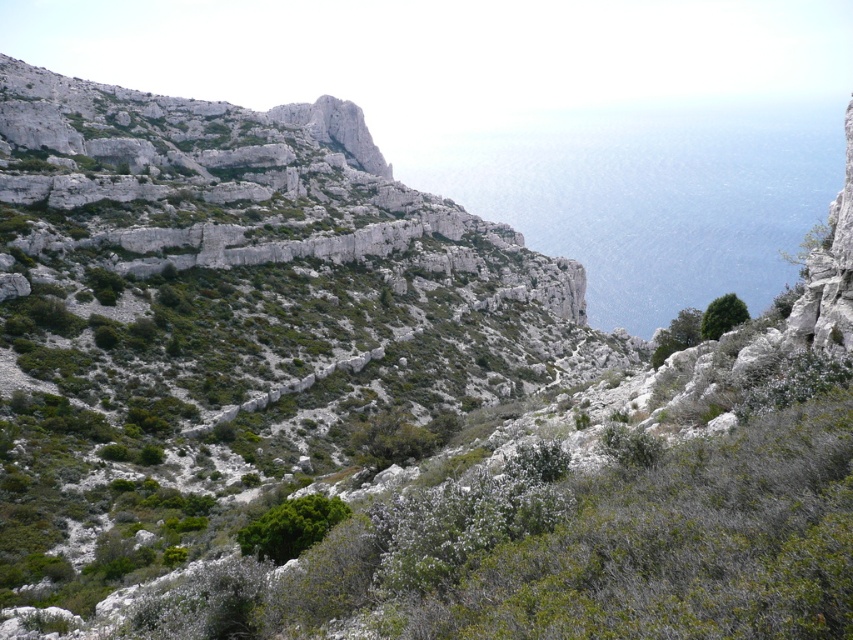
Does green leafy bush at center appear on the left side of green leafy bush at upper right?

Correct, you'll find green leafy bush at center to the left of green leafy bush at upper right.

Identify the location of green leafy bush at center. The image size is (853, 640). (291, 525).

Identify the location of green leafy bush at center. The image size is (853, 640). (291, 525).